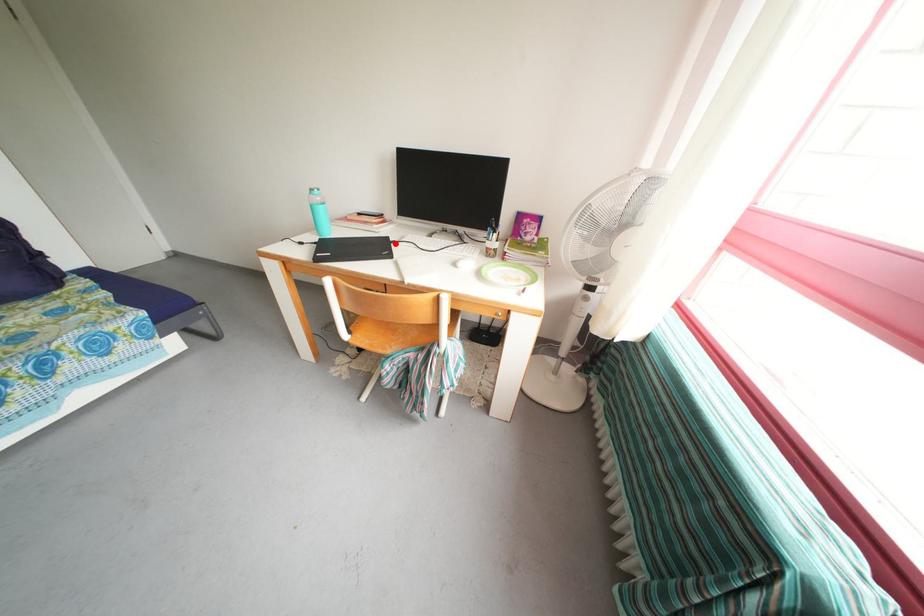
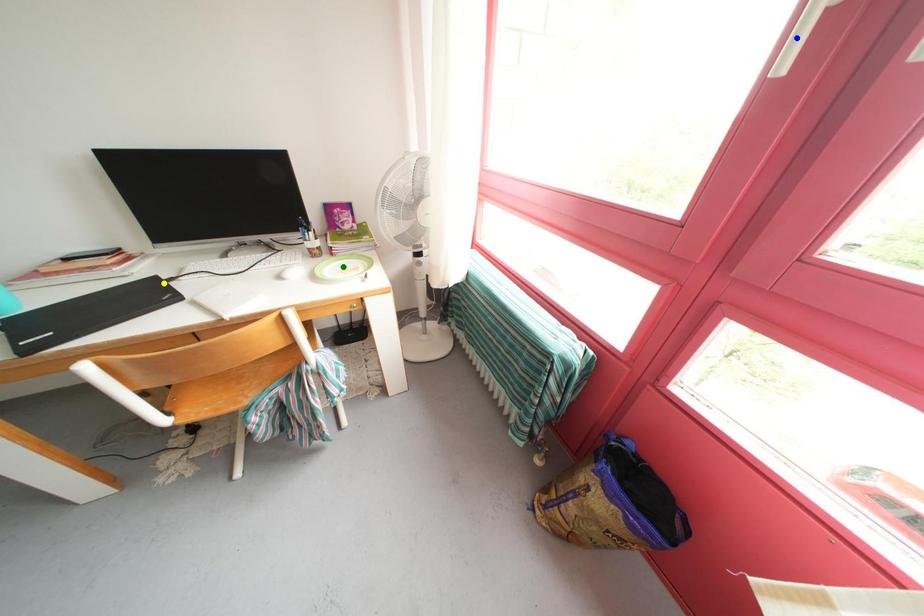
Question: I am providing you with two images of the same scene from different viewpoints. A red point is marked on the first image. You are given multiple points on the second image. In image 2, which mark is for the same physical point as the one in image 1?

Choices:
 (A) green point
 (B) yellow point
 (C) blue point

Answer: (B)